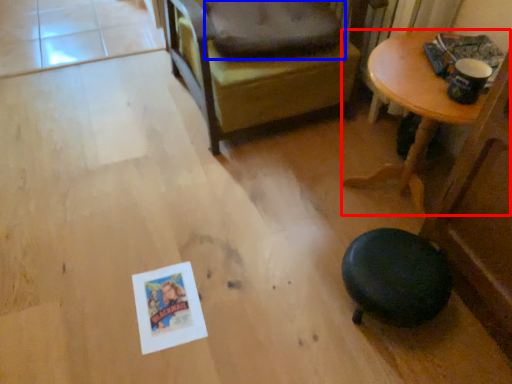
Question: Which of the following is the farthest to the observer, table (highlighted by a red box) or dog bed (highlighted by a blue box)?

Choices:
 (A) table
 (B) dog bed

Answer: (B)